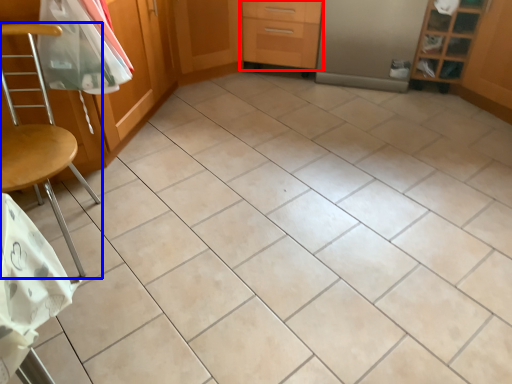
Question: Among these objects, which one is nearest to the camera, drawer (highlighted by a red box) or chair (highlighted by a blue box)?

Choices:
 (A) drawer
 (B) chair

Answer: (B)